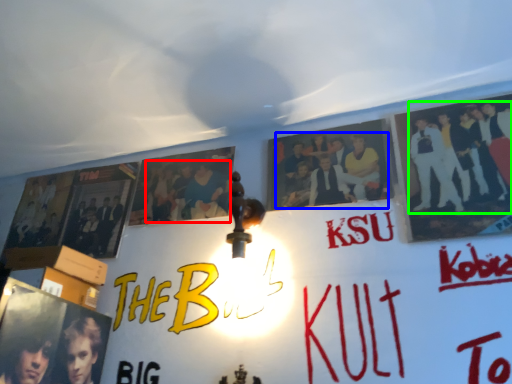
Question: Which is nearer to the person (highlighted by a red box)? person (highlighted by a blue box) or person (highlighted by a green box).

Choices:
 (A) person
 (B) person

Answer: (A)